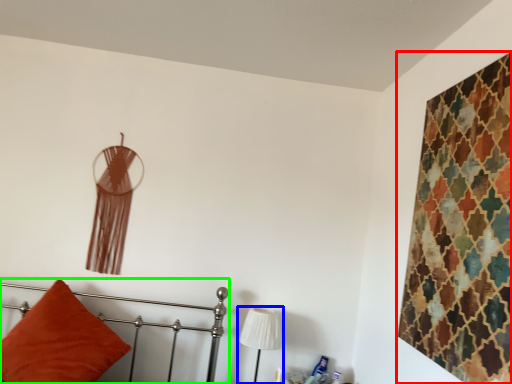
Question: Considering the real-world distances, which object is closest to textile (highlighted by a red box)? table lamp (highlighted by a blue box) or furniture (highlighted by a green box).

Choices:
 (A) table lamp
 (B) furniture

Answer: (A)